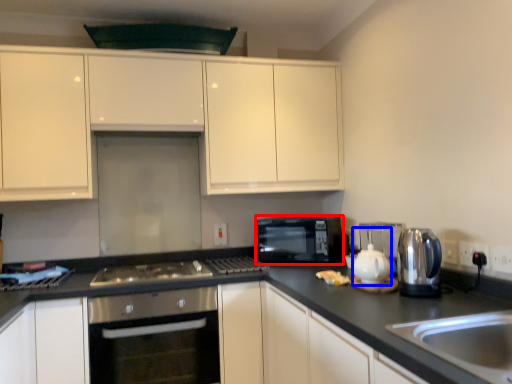
Question: Which point is further to the camera, microwave oven (highlighted by a red box) or tea pot (highlighted by a blue box)?

Choices:
 (A) microwave oven
 (B) tea pot

Answer: (A)